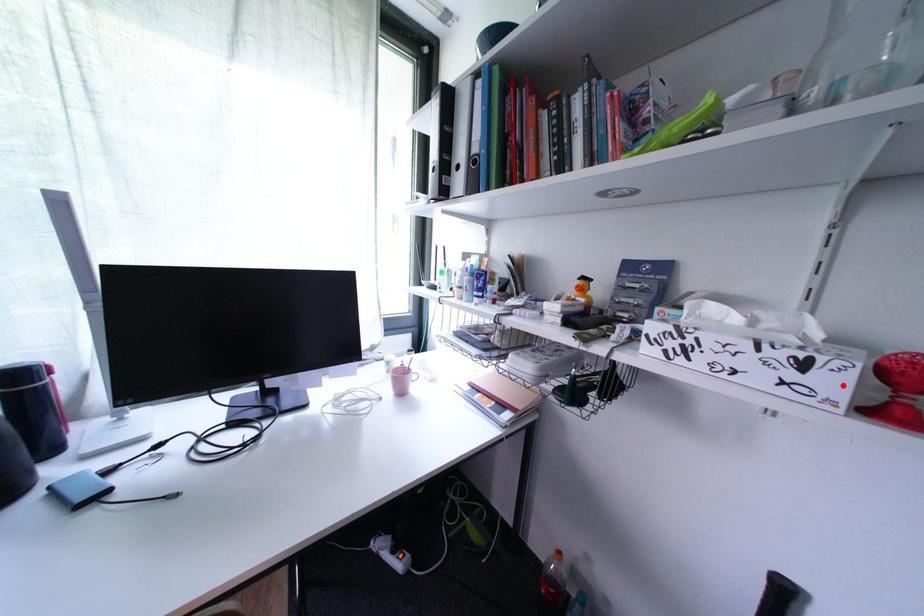
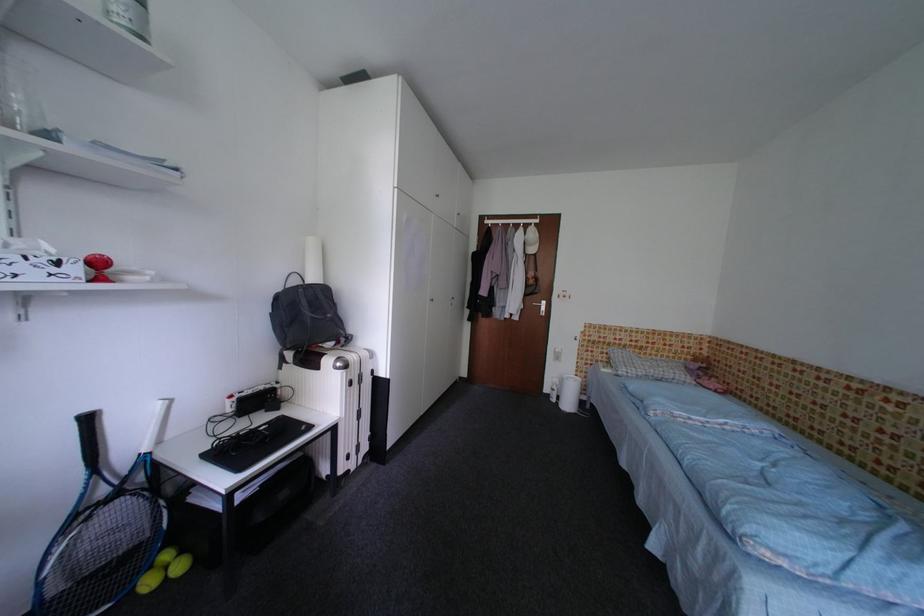
In the second image, find the point that corresponds to the highlighted location in the first image.

(83, 272)